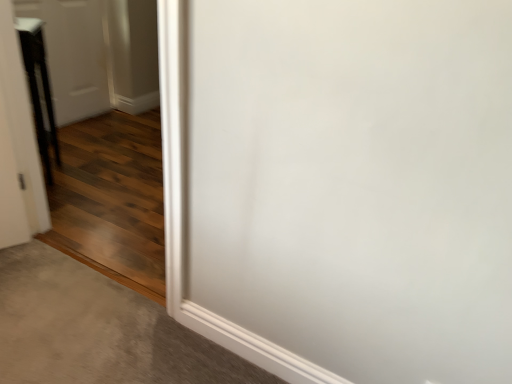
Question: From a real-world perspective, is gray carpet at lower left under white glossy door at upper left, marked as the 2th door in a front-to-back arrangement?

Choices:
 (A) no
 (B) yes

Answer: (B)

Question: Does gray carpet at lower left have a lesser width compared to white glossy door at upper left, marked as the 2th door in a front-to-back arrangement?

Choices:
 (A) no
 (B) yes

Answer: (A)

Question: Does gray carpet at lower left lie behind white glossy door at upper left, the first door in the back-to-front sequence?

Choices:
 (A) yes
 (B) no

Answer: (B)

Question: Is gray carpet at lower left touching white glossy door at upper left, marked as the 2th door in a front-to-back arrangement?

Choices:
 (A) yes
 (B) no

Answer: (B)

Question: From the image's perspective, is gray carpet at lower left below white glossy door at upper left, marked as the 2th door in a front-to-back arrangement?

Choices:
 (A) no
 (B) yes

Answer: (B)

Question: From a real-world perspective, is gray carpet at lower left physically located above or below white glossy door at upper left, marked as the 2th door in a front-to-back arrangement?

Choices:
 (A) below
 (B) above

Answer: (A)

Question: Relative to white glossy door at upper left, marked as the 2th door in a front-to-back arrangement, is gray carpet at lower left in front or behind?

Choices:
 (A) front
 (B) behind

Answer: (A)

Question: Does point (70, 322) appear closer or farther from the camera than point (57, 11)?

Choices:
 (A) farther
 (B) closer

Answer: (B)

Question: From the image's perspective, is gray carpet at lower left above or below white glossy door at upper left, marked as the 2th door in a front-to-back arrangement?

Choices:
 (A) above
 (B) below

Answer: (B)

Question: Is point (55, 110) closer or farther from the camera than point (28, 359)?

Choices:
 (A) closer
 (B) farther

Answer: (B)

Question: From their relative heights in the image, would you say white glossy door at upper left, marked as the 2th door in a front-to-back arrangement, is taller or shorter than gray carpet at lower left?

Choices:
 (A) tall
 (B) short

Answer: (A)

Question: Choose the correct answer: Is white glossy door at upper left, marked as the 2th door in a front-to-back arrangement, inside gray carpet at lower left or outside it?

Choices:
 (A) inside
 (B) outside

Answer: (B)

Question: In terms of width, does white glossy door at upper left, marked as the 2th door in a front-to-back arrangement, look wider or thinner when compared to gray carpet at lower left?

Choices:
 (A) wide
 (B) thin

Answer: (B)

Question: Based on their sizes in the image, would you say white glossy door at upper left, the first door in the back-to-front sequence, is bigger or smaller than black glossy door at left, the 2th door viewed from the back?

Choices:
 (A) small
 (B) big

Answer: (B)

Question: Considering the relative positions of white glossy door at upper left, the first door in the back-to-front sequence, and black glossy door at left, the 2th door viewed from the back, in the image provided, is white glossy door at upper left, the first door in the back-to-front sequence, to the left or to the right of black glossy door at left, the 2th door viewed from the back,?

Choices:
 (A) left
 (B) right

Answer: (A)